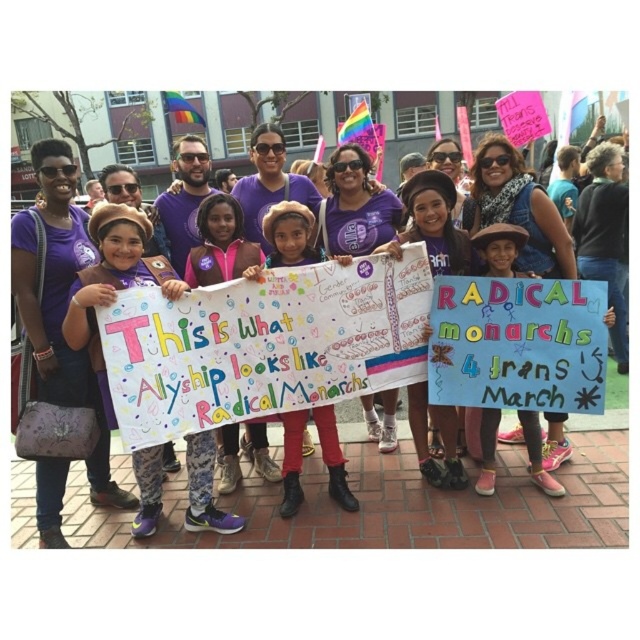
From the picture: You are standing in the crowd holding a sign and want to take a photo of both the point at (83, 493) and the point at (196, 285). Which point should you focus on first to ensure both are in focus?

You should focus on the point at (196, 285) first because it is closer to you than the point at (83, 493), which is further away. By focusing on the closer point, the further one will also be in focus due to the depth of field.